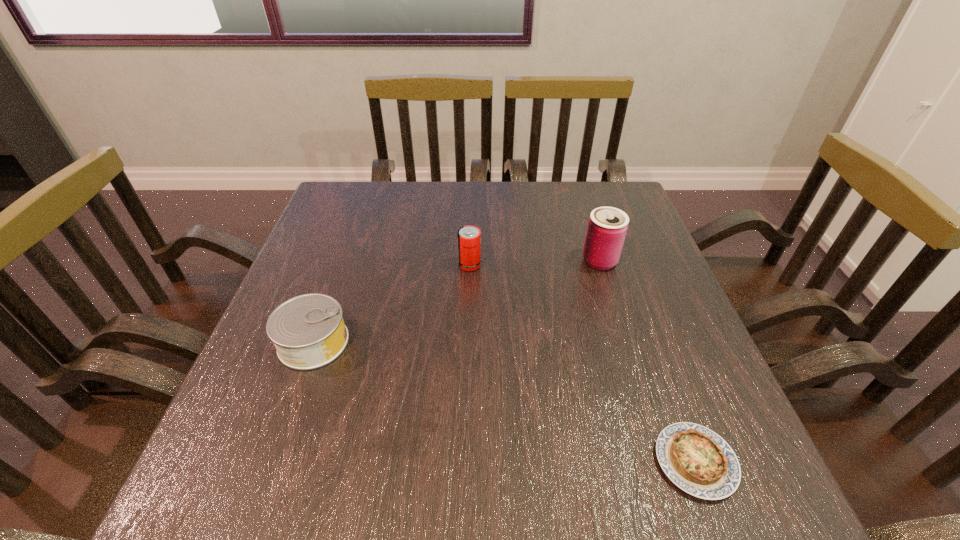
At what (x,y) coordinates should I click in order to perform the action: click on vacant point located on the front of the shortest can. Please return your answer as a coordinate pair (x, y). The image size is (960, 540). Looking at the image, I should click on (284, 424).

Identify the location of vacant area situated 0.340m on the left of the shortest object. (444, 462).

Locate an element on the screen. The height and width of the screenshot is (540, 960). object that is at the near edge is located at coordinates (697, 460).

I want to click on object present at the left edge, so click(x=308, y=331).

Image resolution: width=960 pixels, height=540 pixels. I want to click on can at the right edge, so click(607, 227).

This screenshot has height=540, width=960. I want to click on quiche located in the right edge section of the desktop, so click(x=697, y=460).

This screenshot has height=540, width=960. Identify the location of object that is at the near right corner. (697, 460).

The height and width of the screenshot is (540, 960). In the image, there is a desktop. What are the coordinates of `vacant space at the far edge` in the screenshot? It's located at (425, 183).

In the image, there is a desktop. Identify the location of vacant region at the near edge. The width and height of the screenshot is (960, 540). (350, 456).

Find the location of a particular element. vacant space at the right edge of the desktop is located at coordinates (679, 400).